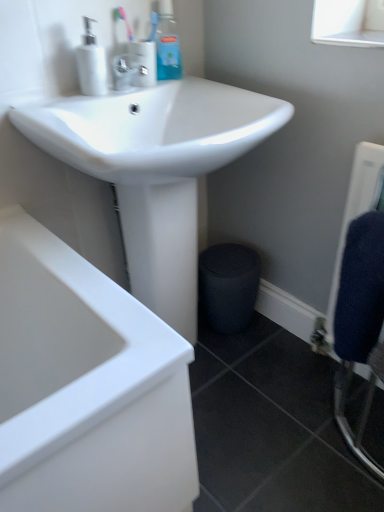
Question: Considering their positions, is blue plastic bottle at upper center, the 2th toiletry when ordered from left to right, located in front of or behind pink plastic toothbrush at upper center?

Choices:
 (A) front
 (B) behind

Answer: (B)

Question: Would you say blue plastic bottle at upper center, the 2th toiletry when ordered from left to right, is to the left or to the right of pink plastic toothbrush at upper center in the picture?

Choices:
 (A) left
 (B) right

Answer: (B)

Question: Estimate the real-world distances between objects in this image. Which object is closer to the dark blue textured towel at right?

Choices:
 (A) pink plastic toothbrush at upper center
 (B) satin nickel faucet at upper center, which appears as the 2th toiletry when viewed from the right
 (C) white glossy faucet at upper center
 (D) white glossy soap dispenser at upper left
 (E) blue plastic bottle at upper center, the 1th toiletry in the right-to-left sequence

Answer: (B)

Question: Considering the real-world distances, which object is farthest from the white glossy sink at upper center?

Choices:
 (A) white glossy faucet at upper center
 (B) white glossy soap dispenser at upper left
 (C) pink plastic toothbrush at upper center
 (D) satin nickel faucet at upper center, placed as the 1th toiletry when sorted from left to right
 (E) dark blue textured towel at right

Answer: (E)